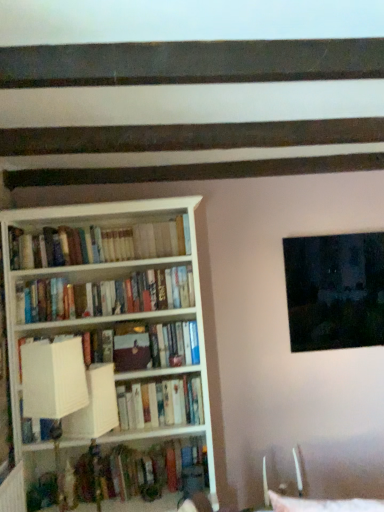
Identify the location of empty space that is ontop of matte brown book at center (from a real-world perspective). Image resolution: width=384 pixels, height=512 pixels. (129, 324).